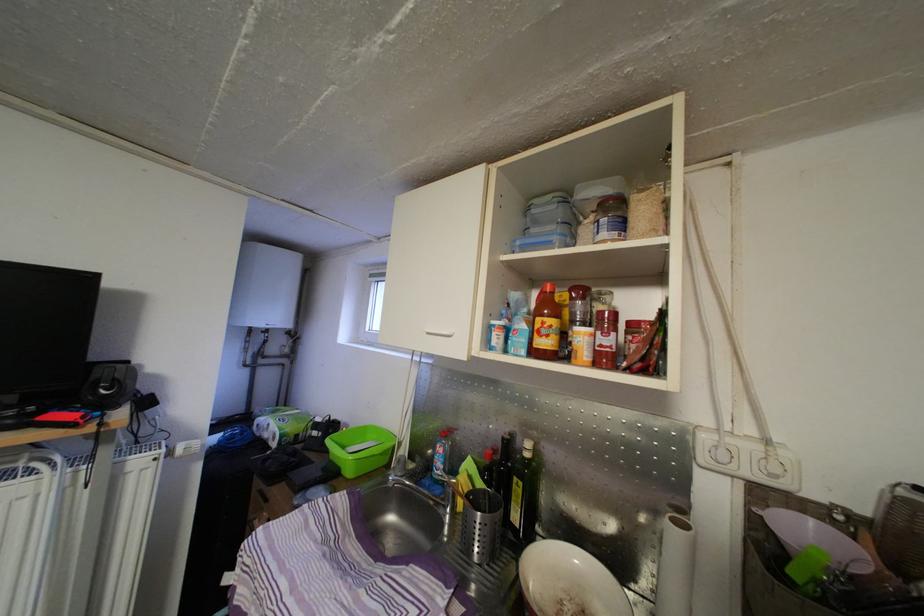
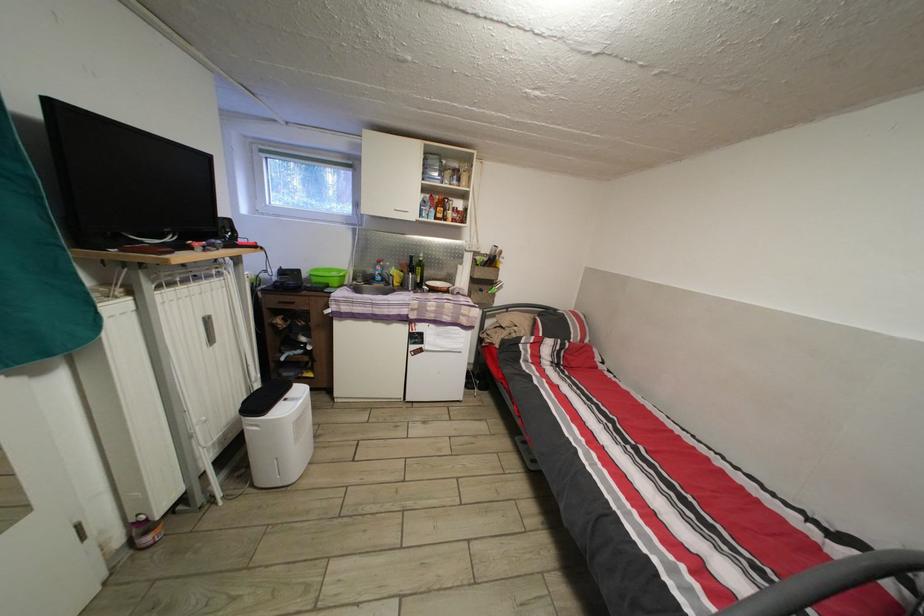
The point at (544,326) is marked in the first image. Where is the corresponding point in the second image?

(445, 215)